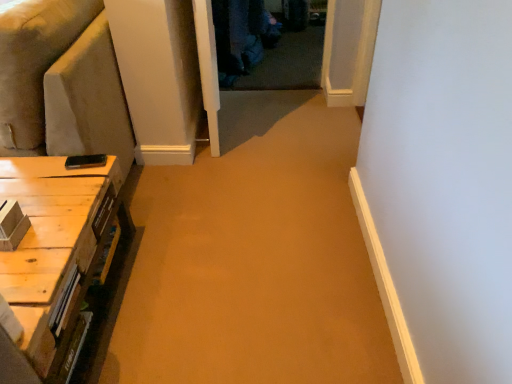
What is the approximate height of suede-like beige couch at left?

suede-like beige couch at left is 35.51 inches in height.

What do you see at coordinates (61, 82) in the screenshot?
I see `suede-like beige couch at left` at bounding box center [61, 82].

Image resolution: width=512 pixels, height=384 pixels. Find the location of `suede-like beige couch at left`. suede-like beige couch at left is located at coordinates pos(61,82).

At what (x,y) coordinates should I click in order to perform the action: click on light brown wood table at lower left. Please return your answer as a coordinate pair (x, y). The image size is (512, 384). Looking at the image, I should click on (54, 246).

What do you see at coordinates (54, 246) in the screenshot? I see `light brown wood table at lower left` at bounding box center [54, 246].

This screenshot has height=384, width=512. What are the coordinates of `suede-like beige couch at left` in the screenshot? It's located at (61, 82).

Is suede-like beige couch at left to the right of light brown wood table at lower left from the viewer's perspective?

In fact, suede-like beige couch at left is to the left of light brown wood table at lower left.

In the scene shown: Considering the positions of objects suede-like beige couch at left and light brown wood table at lower left in the image provided, who is in front, suede-like beige couch at left or light brown wood table at lower left?

light brown wood table at lower left is more forward.

Is point (48, 85) closer or farther from the camera than point (26, 189)?

Clearly, point (48, 85) is more distant from the camera than point (26, 189).

From the image's perspective, does suede-like beige couch at left appear higher than light brown wood table at lower left?

Correct, suede-like beige couch at left appears higher than light brown wood table at lower left in the image.

From a real-world perspective, is suede-like beige couch at left physically located above or below light brown wood table at lower left?

suede-like beige couch at left is situated higher than light brown wood table at lower left in the real world.

Considering the sizes of suede-like beige couch at left and light brown wood table at lower left in the image, is suede-like beige couch at left wider or thinner than light brown wood table at lower left?

suede-like beige couch at left is wider than light brown wood table at lower left.

Is suede-like beige couch at left taller than light brown wood table at lower left?

Yes.

Which of these two, suede-like beige couch at left or light brown wood table at lower left, is bigger?

suede-like beige couch at left is bigger.

Is light brown wood table at lower left inside suede-like beige couch at left?

No, light brown wood table at lower left is located outside of suede-like beige couch at left.

Can you see suede-like beige couch at left touching light brown wood table at lower left?

They are not placed beside each other.

Does suede-like beige couch at left turn towards light brown wood table at lower left?

No, suede-like beige couch at left is not turned towards light brown wood table at lower left.

Image resolution: width=512 pixels, height=384 pixels. I want to click on table on the right of suede-like beige couch at left, so click(54, 246).

From the picture: Based on their positions, is light brown wood table at lower left located to the left or right of suede-like beige couch at left?

light brown wood table at lower left is to the right of suede-like beige couch at left.

Considering the positions of objects light brown wood table at lower left and suede-like beige couch at left in the image provided, who is in front, light brown wood table at lower left or suede-like beige couch at left?

light brown wood table at lower left.

Which is behind, point (114, 178) or point (104, 91)?

Point (104, 91)

From the image's perspective, would you say light brown wood table at lower left is shown under suede-like beige couch at left?

Correct, light brown wood table at lower left appears lower than suede-like beige couch at left in the image.

From a real-world perspective, does light brown wood table at lower left stand above suede-like beige couch at left?

No, from a real-world perspective, light brown wood table at lower left is not above suede-like beige couch at left.

Is light brown wood table at lower left wider than suede-like beige couch at left?

No.

In terms of height, does light brown wood table at lower left look taller or shorter compared to suede-like beige couch at left?

light brown wood table at lower left is shorter than suede-like beige couch at left.

Looking at this image, considering the sizes of objects light brown wood table at lower left and suede-like beige couch at left in the image provided, who is smaller, light brown wood table at lower left or suede-like beige couch at left?

light brown wood table at lower left.

Can we say light brown wood table at lower left lies outside suede-like beige couch at left?

That's correct, light brown wood table at lower left is outside of suede-like beige couch at left.

Are light brown wood table at lower left and suede-like beige couch at left making contact?

No, light brown wood table at lower left is not touching suede-like beige couch at left.

Is suede-like beige couch at left at the back of light brown wood table at lower left?

light brown wood table at lower left does not have its back to suede-like beige couch at left.

You are a GUI agent. You are given a task and a screenshot of the screen. Output one action in this format:
    pyautogui.click(x=<x>, y=<y>)
    Task: Click on the couch above the light brown wood table at lower left (from a real-world perspective)
    Image resolution: width=512 pixels, height=384 pixels.
    Given the screenshot: What is the action you would take?
    pyautogui.click(x=61, y=82)

This screenshot has height=384, width=512. I want to click on couch lying behind the light brown wood table at lower left, so click(61, 82).

Image resolution: width=512 pixels, height=384 pixels. I want to click on table that is below the suede-like beige couch at left (from the image's perspective), so click(54, 246).